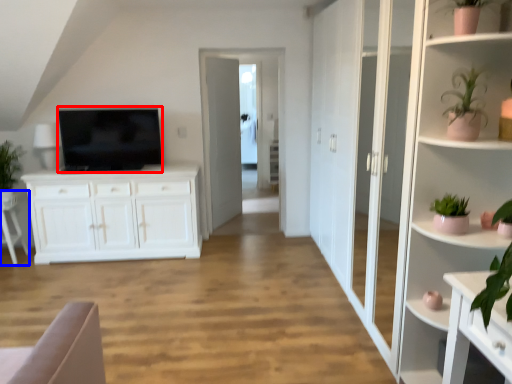
Question: Which of the following is the farthest to the observer, television (highlighted by a red box) or armchair (highlighted by a blue box)?

Choices:
 (A) television
 (B) armchair

Answer: (B)